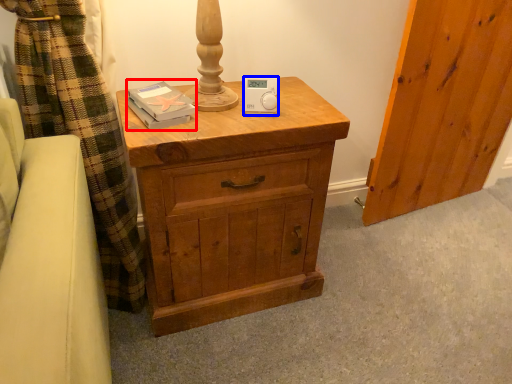
Question: Among these objects, which one is farthest to the camera, book (highlighted by a red box) or ipod (highlighted by a blue box)?

Choices:
 (A) book
 (B) ipod

Answer: (B)